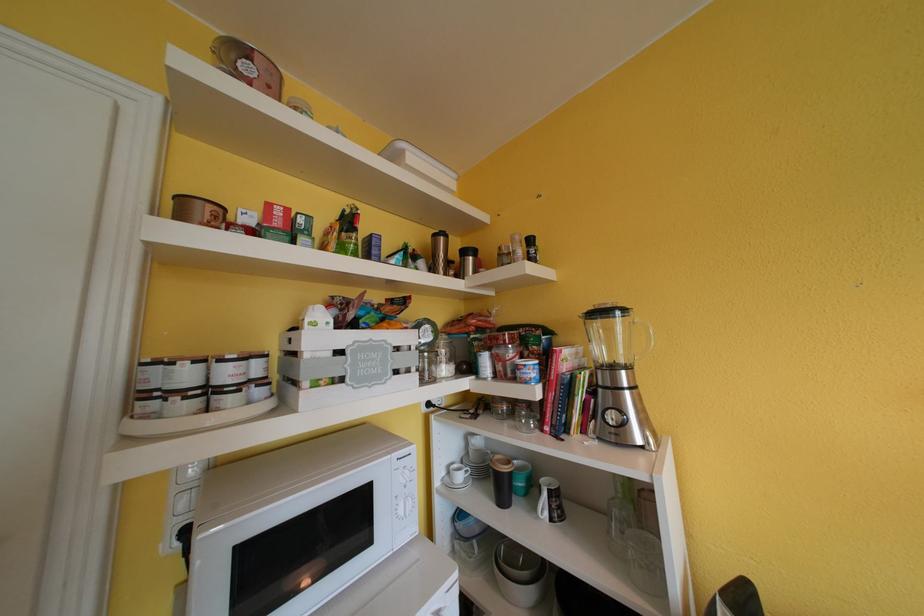
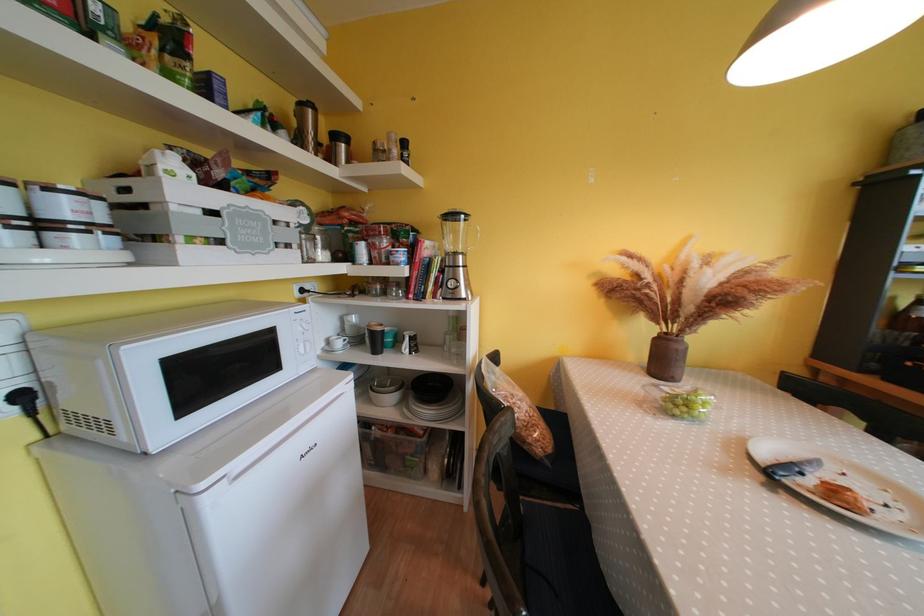
In the second image, find the point that corresponds to (467,480) in the first image.

(345, 347)